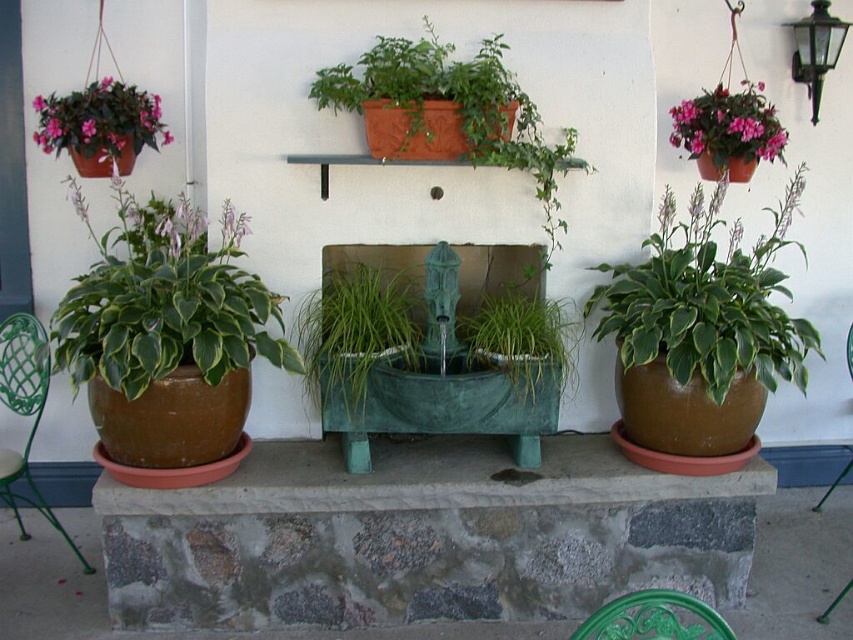
You are standing in the outdoor area looking at the fountain. Where is the green matte pot at left located in relation to the fountain?

The green matte pot at left is located at point (164, 300) relative to the fountain.

Looking at this image, you are standing in the garden scene and want to water the green matte pot at left. If your watering can has a range of 2 meters, can you reach it without moving closer?

The green matte pot at left is 2.52 meters away from the viewer. Since the watering can only reaches 2 meters, you cannot reach it without moving closer.

Looking at this image, you are sitting on the green metal chair at lower center and want to place a book on the black glass lamp at upper right. Considering their heights, will you need to reach up or down to place the book?

The green metal chair at lower center has a lesser height compared to black glass lamp at upper right, so you will need to reach upwards to place the book on the black glass lamp at upper right.